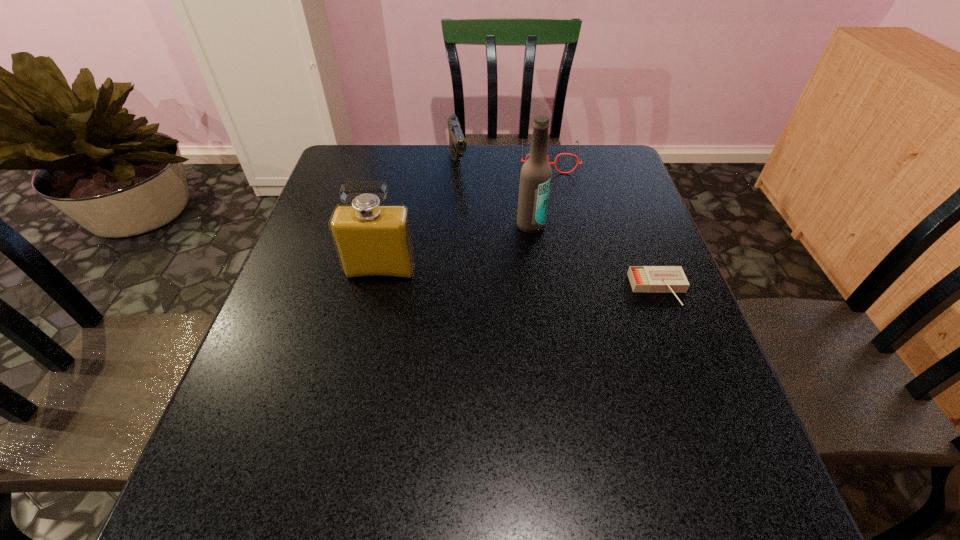
The width and height of the screenshot is (960, 540). In order to click on pistol located at the far edge in this screenshot , I will do `click(457, 144)`.

At what (x,y) coordinates should I click in order to perform the action: click on spectacles located in the far edge section of the desktop. Please return your answer as a coordinate pair (x, y). The height and width of the screenshot is (540, 960). Looking at the image, I should click on (554, 163).

At what (x,y) coordinates should I click in order to perform the action: click on object situated at the left edge. Please return your answer as a coordinate pair (x, y). Image resolution: width=960 pixels, height=540 pixels. Looking at the image, I should click on (373, 241).

Find the location of a particular element. matchbox positioned at the right edge is located at coordinates (642, 278).

At what (x,y) coordinates should I click in order to perform the action: click on spectacles present at the right edge. Please return your answer as a coordinate pair (x, y). This screenshot has height=540, width=960. Looking at the image, I should click on (554, 163).

Find the location of a particular element. object located in the far right corner section of the desktop is located at coordinates (554, 163).

This screenshot has height=540, width=960. What are the coordinates of `blank space at the far edge of the desktop` in the screenshot? It's located at click(x=399, y=174).

In the image, there is a desktop. What are the coordinates of `free space at the near edge` in the screenshot? It's located at (350, 442).

Where is `free point at the left edge`? free point at the left edge is located at coordinates (305, 295).

This screenshot has height=540, width=960. Identify the location of free space at the far right corner. (586, 164).